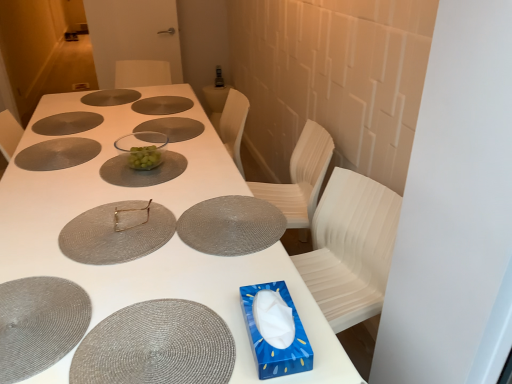
At what (x,y) coordinates should I click in order to perform the action: click on vacant space in woven gray placemat at lower left (from a real-world perspective). Please return your answer as a coordinate pair (x, y). The width and height of the screenshot is (512, 384). Looking at the image, I should click on (31, 322).